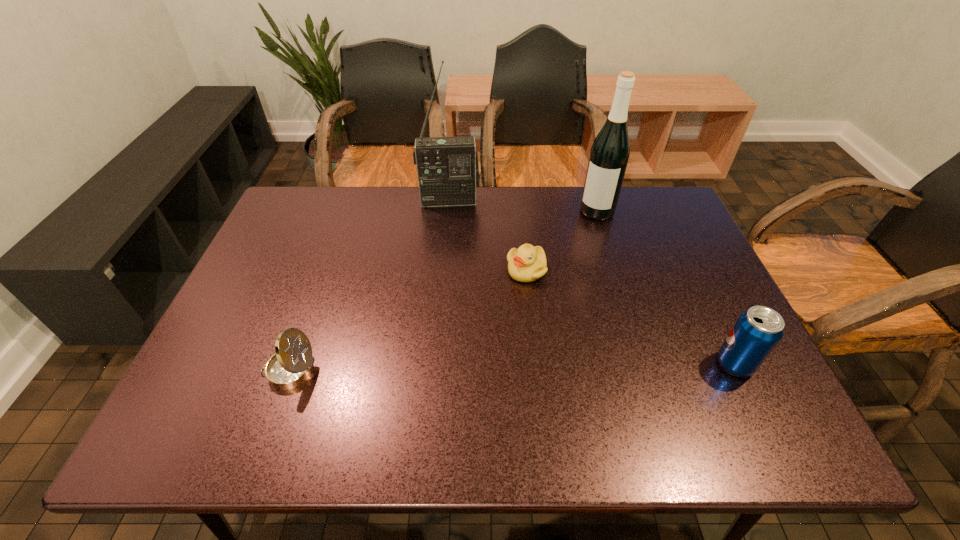
This screenshot has width=960, height=540. Identify the location of free point between the radio receiver and the second shortest object. (369, 286).

Find the location of a particular element. empty space between the leftmost object and the rightmost object is located at coordinates (512, 367).

Find the location of `object that is the third closest to the shortest object`. object that is the third closest to the shortest object is located at coordinates (757, 331).

The width and height of the screenshot is (960, 540). Find the location of `object that stands as the closest to the pop soda`. object that stands as the closest to the pop soda is located at coordinates (527, 263).

You are a GUI agent. You are given a task and a screenshot of the screen. Output one action in this format:
    pyautogui.click(x=<x>, y=<y>)
    Task: Click on the vacant area that satisfies the following two spatial constraints: 1. on the front side of the shortest object; 2. on the right side of the rightmost object
    The height and width of the screenshot is (540, 960).
    Given the screenshot: What is the action you would take?
    pyautogui.click(x=537, y=363)

Locate an element on the screen. This screenshot has height=540, width=960. vacant area that satisfies the following two spatial constraints: 1. on the front side of the fourth object from left to right; 2. on the right side of the radio receiver is located at coordinates (448, 211).

You are a GUI agent. You are given a task and a screenshot of the screen. Output one action in this format:
    pyautogui.click(x=<x>, y=<y>)
    Task: Click on the free space that satisfies the following two spatial constraints: 1. on the back side of the wine bottle; 2. on the left side of the duckling
    The image size is (960, 540).
    Given the screenshot: What is the action you would take?
    pyautogui.click(x=520, y=211)